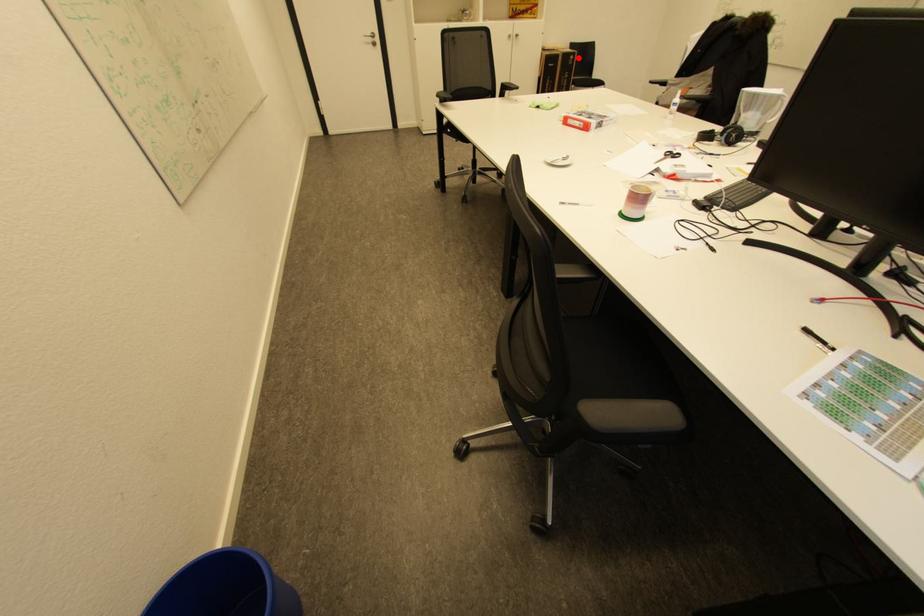
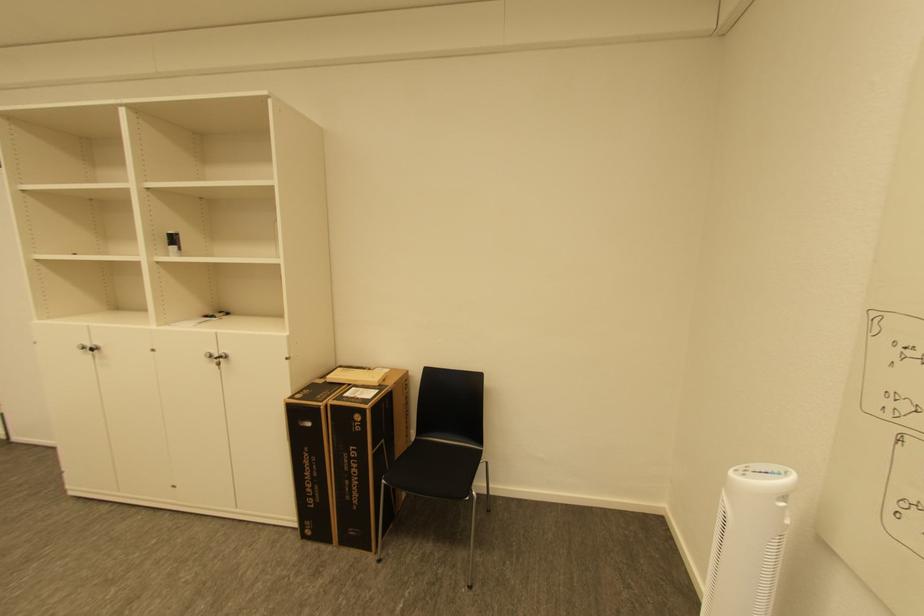
Find the pixel in the second image that matches the highlighted location in the first image.

(363, 418)